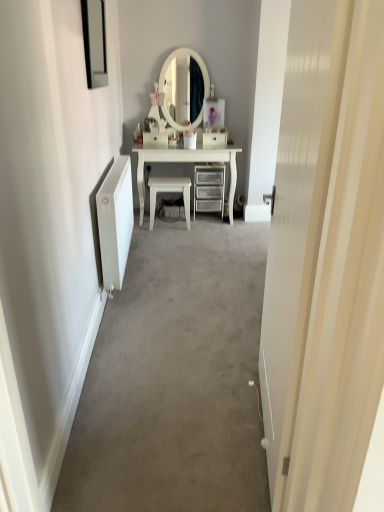
What are the coordinates of `blank space above white glossy drawer at center, which appears as the first drawer when viewed from the right (from a real-world perspective)` in the screenshot? It's located at (212, 131).